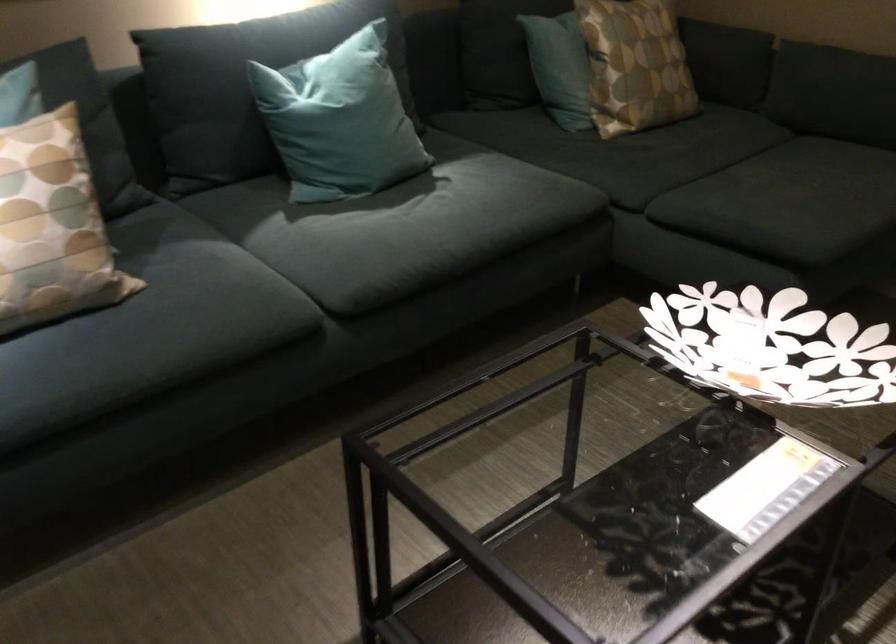
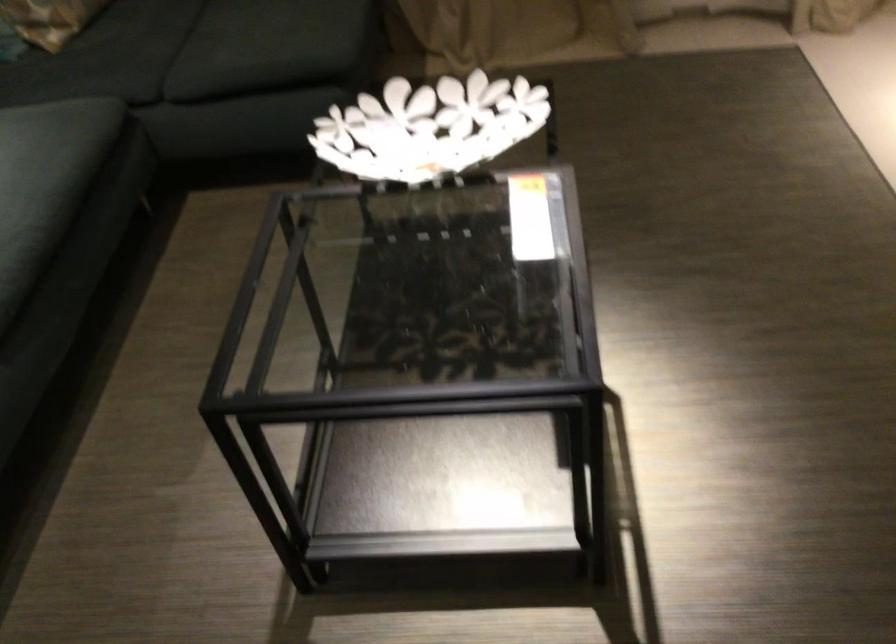
Locate, in the second image, the point that corresponds to (x=599, y=158) in the first image.

(85, 73)